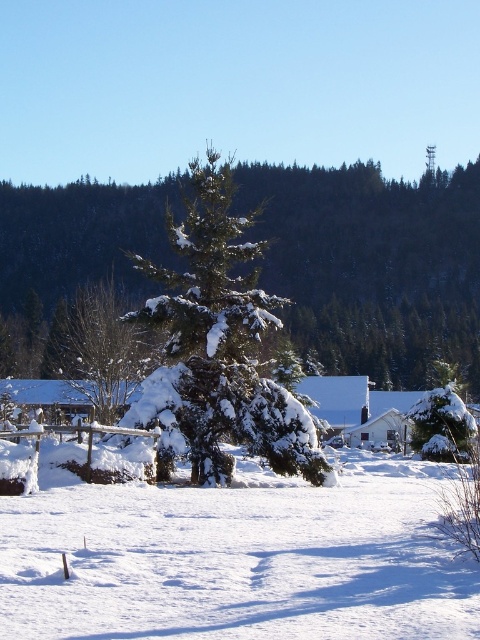
You are standing in a winter landscape and see a point marked at coordinates (x=225, y=340). What object is located at that point?

The point at coordinates (x=225, y=340) marks the green textured pine tree at center.

You are standing in the winter landscape and want to take a photo of both the green textured pine tree at center and the white matte house at center. Which one should you adjust your camera focus to capture first, the one closer to you or the one further away?

The green textured pine tree at center is above the white matte house at center, so the pine tree is closer to you. Adjust your camera focus to capture the green textured pine tree at center first since it is nearer.